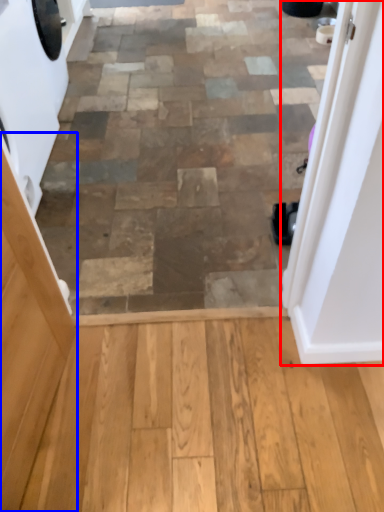
Question: Which point is further to the camera, door (highlighted by a red box) or screen door (highlighted by a blue box)?

Choices:
 (A) door
 (B) screen door

Answer: (A)